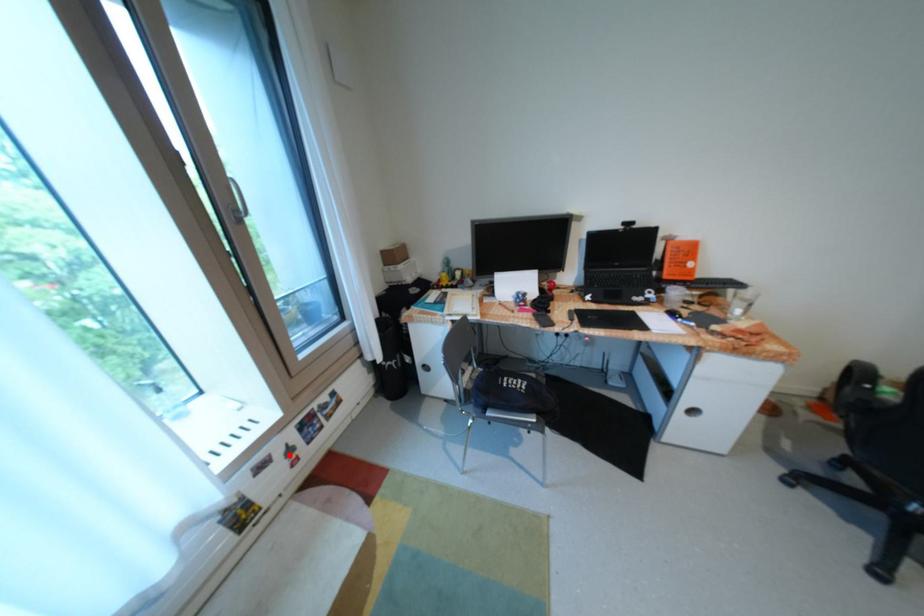
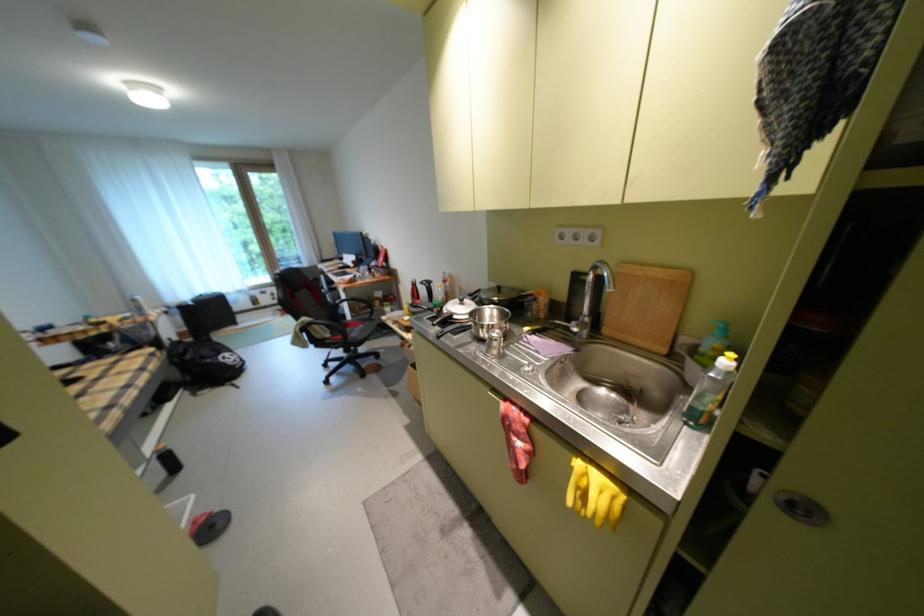
Where in the second image is the point corresponding to the highlighted location from the first image?

(280, 294)